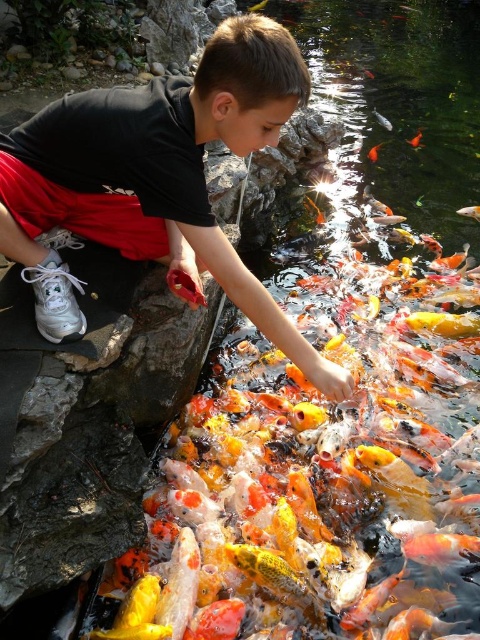
You are standing near the pond and want to observe the orange and white scales at upper right and the shiny orange fish at center. Which one appears closer to you?

The orange and white scales at upper right are closer to the viewer than the shiny orange fish at center.

You are a photographer trying to capture the boy feeding the koi fish. You want to ensure the black matte shirt at upper left is visible in the photo. Which part of the scene should you focus on to include it?

To ensure the black matte shirt at upper left is visible in the photo, focus on the upper left area of the scene where it is located at point coordinates (158, 179).

You are a photographer trying to capture the boy feeding the fish. You need to ensure both the black matte shirt at upper left and the orange and white textured fish at center are clearly visible in your photo. Based on their positions, which object should you focus on first to ensure depth of field captures both?

The black matte shirt at upper left has a greater height compared to the orange and white textured fish at center. To ensure both are in focus, you should focus on the black matte shirt at upper left first since it is farther away and adjusting depth of field from there would better include the closer fish.